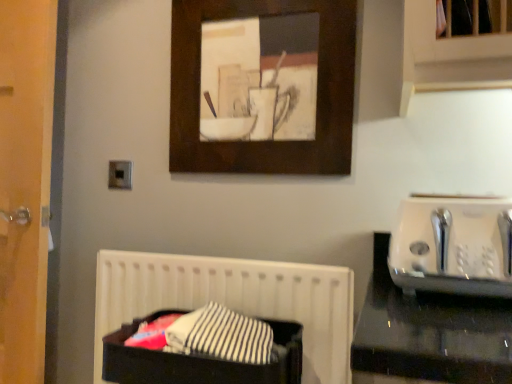
The width and height of the screenshot is (512, 384). Describe the element at coordinates (261, 142) in the screenshot. I see `wooden picture frame at upper center` at that location.

At what (x,y) coordinates should I click in order to perform the action: click on black fabric at lower left. Please return your answer as a coordinate pair (x, y). Looking at the image, I should click on click(x=233, y=299).

The height and width of the screenshot is (384, 512). What are the coordinates of `metallic silver outlet at upper left` in the screenshot? It's located at (120, 175).

This screenshot has width=512, height=384. In order to click on wooden picture frame at upper center in this screenshot , I will do `click(261, 142)`.

Considering the sizes of white plastic toaster at right and metallic silver outlet at upper left in the image, is white plastic toaster at right bigger or smaller than metallic silver outlet at upper left?

Clearly, white plastic toaster at right is larger in size than metallic silver outlet at upper left.

Is metallic silver outlet at upper left a part of white plastic toaster at right?

Actually, metallic silver outlet at upper left is outside white plastic toaster at right.

Which object is closer to the camera, white plastic toaster at right or metallic silver outlet at upper left?

white plastic toaster at right is more forward.

From a real-world perspective, who is located higher, wooden picture frame at upper center or black fabric at lower left?

wooden picture frame at upper center, from a real-world perspective.

Consider the image. Does wooden picture frame at upper center touch black fabric at lower left?

No, wooden picture frame at upper center is not touching black fabric at lower left.

Between metallic silver outlet at upper left and black fabric at lower left, which one has smaller width?

With smaller width is metallic silver outlet at upper left.

Which of these two, metallic silver outlet at upper left or black fabric at lower left, stands taller?

black fabric at lower left.

This screenshot has width=512, height=384. In the image, there is a metallic silver outlet at upper left. Identify the location of bed below it (from a real-world perspective). (233, 299).

Which object is wider, wooden picture frame at upper center or black fabric laundry basket at lower center?

With larger width is black fabric laundry basket at lower center.

How many degrees apart are the facing directions of wooden picture frame at upper center and black fabric laundry basket at lower center?

The angular difference between wooden picture frame at upper center and black fabric laundry basket at lower center is 0.423 degrees.

Is wooden picture frame at upper center looking in the opposite direction of black fabric laundry basket at lower center?

No.

From a real-world perspective, is wooden picture frame at upper center physically above black fabric laundry basket at lower center?

Yes, from a real-world perspective, wooden picture frame at upper center is on top of black fabric laundry basket at lower center.

Are black fabric at lower left and white plastic toaster at right located far from each other?

No, there isn't a large distance between black fabric at lower left and white plastic toaster at right.

Relative to white plastic toaster at right, is black fabric at lower left in front or behind?

In the image, black fabric at lower left appears behind white plastic toaster at right.

How different are the orientations of black fabric at lower left and white plastic toaster at right in degrees?

The angular difference between black fabric at lower left and white plastic toaster at right is 2.11 degrees.

Between black fabric laundry basket at lower center and black fabric at lower left, which one has smaller size?

With smaller size is black fabric laundry basket at lower center.

From the image's perspective, is black fabric laundry basket at lower center beneath black fabric at lower left?

No, from the image's perspective, black fabric laundry basket at lower center is not below black fabric at lower left.

From a real-world perspective, who is located higher, black fabric laundry basket at lower center or black fabric at lower left?

black fabric laundry basket at lower center is physically above.

Considering the positions of objects black fabric laundry basket at lower center and black fabric at lower left in the image provided, who is behind, black fabric laundry basket at lower center or black fabric at lower left?

Positioned behind is black fabric at lower left.

Is metallic silver outlet at upper left not close to white plastic toaster at right?

metallic silver outlet at upper left is near white plastic toaster at right, not far away.

From the image's perspective, is metallic silver outlet at upper left above or below white plastic toaster at right?

Based on their image positions, metallic silver outlet at upper left is located above white plastic toaster at right.

Which is more to the right, metallic silver outlet at upper left or white plastic toaster at right?

white plastic toaster at right.

The height and width of the screenshot is (384, 512). In the image, there is a metallic silver outlet at upper left. In order to click on appliance below it (from a real-world perspective) in this screenshot , I will do `click(453, 245)`.

You are a GUI agent. You are given a task and a screenshot of the screen. Output one action in this format:
    pyautogui.click(x=<x>, y=<y>)
    Task: Click on the picture frame behind the black fabric at lower left
    Image resolution: width=512 pixels, height=384 pixels.
    Given the screenshot: What is the action you would take?
    pyautogui.click(x=261, y=142)

Which object lies nearer to the anchor point metallic silver outlet at upper left, black fabric laundry basket at lower center or black fabric at lower left?

black fabric at lower left is closer to metallic silver outlet at upper left.

Looking at the image, which one is located further to black fabric at lower left, black fabric laundry basket at lower center or white plastic toaster at right?

white plastic toaster at right is further to black fabric at lower left.

Which object lies further to the anchor point black fabric laundry basket at lower center, black fabric at lower left or wooden picture frame at upper center?

wooden picture frame at upper center lies further to black fabric laundry basket at lower center than the other object.

Looking at the image, which one is located further to wooden picture frame at upper center, metallic silver outlet at upper left or black fabric at lower left?

metallic silver outlet at upper left lies further to wooden picture frame at upper center than the other object.

Based on their spatial positions, is white plastic toaster at right or black fabric laundry basket at lower center closer to wooden picture frame at upper center?

white plastic toaster at right is closer to wooden picture frame at upper center.

When comparing their distances from metallic silver outlet at upper left, does black fabric laundry basket at lower center or wooden picture frame at upper center seem further?

Among the two, black fabric laundry basket at lower center is located further to metallic silver outlet at upper left.

Estimate the real-world distances between objects in this image. Which object is closer to black fabric laundry basket at lower center, metallic silver outlet at upper left or black fabric at lower left?

black fabric at lower left is positioned closer to the anchor black fabric laundry basket at lower center.

Looking at this image, considering their positions, is metallic silver outlet at upper left positioned closer to white plastic toaster at right than black fabric laundry basket at lower center?

The object closer to white plastic toaster at right is black fabric laundry basket at lower center.

This screenshot has height=384, width=512. Identify the location of laundry basket between metallic silver outlet at upper left and white plastic toaster at right in the horizontal direction. (199, 360).

Where is `laundry basket situated between black fabric at lower left and white plastic toaster at right from left to right`? The image size is (512, 384). laundry basket situated between black fabric at lower left and white plastic toaster at right from left to right is located at coordinates (199, 360).

This screenshot has width=512, height=384. Identify the location of bed positioned between black fabric laundry basket at lower center and metallic silver outlet at upper left from near to far. (233, 299).

The width and height of the screenshot is (512, 384). I want to click on appliance between wooden picture frame at upper center and black fabric laundry basket at lower center vertically, so click(453, 245).